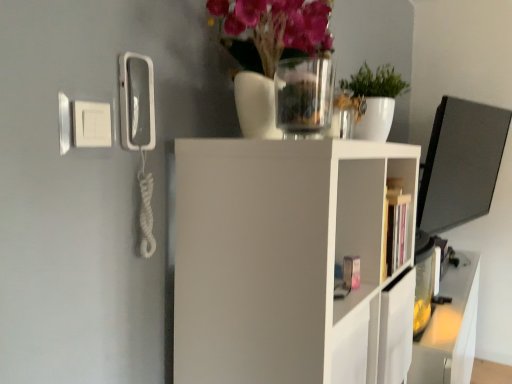
Question: Is transparent glass vase at upper center directly adjacent to translucent glass vase at upper center?

Choices:
 (A) yes
 (B) no

Answer: (A)

Question: Is transparent glass vase at upper center positioned far away from translucent glass vase at upper center?

Choices:
 (A) no
 (B) yes

Answer: (A)

Question: Does transparent glass vase at upper center have a greater height compared to translucent glass vase at upper center?

Choices:
 (A) no
 (B) yes

Answer: (A)

Question: Is transparent glass vase at upper center wider than translucent glass vase at upper center?

Choices:
 (A) no
 (B) yes

Answer: (A)

Question: Considering the relative positions of transparent glass vase at upper center and translucent glass vase at upper center in the image provided, is transparent glass vase at upper center behind translucent glass vase at upper center?

Choices:
 (A) yes
 (B) no

Answer: (A)

Question: From a real-world perspective, is green matte plant at upper center above or below matte plastic cabinet at center?

Choices:
 (A) above
 (B) below

Answer: (A)

Question: Is green matte plant at upper center inside or outside of matte plastic cabinet at center?

Choices:
 (A) outside
 (B) inside

Answer: (A)

Question: Considering the positions of green matte plant at upper center and matte plastic cabinet at center in the image, is green matte plant at upper center bigger or smaller than matte plastic cabinet at center?

Choices:
 (A) big
 (B) small

Answer: (A)

Question: Is green matte plant at upper center wider or thinner than matte plastic cabinet at center?

Choices:
 (A) wide
 (B) thin

Answer: (A)

Question: In terms of size, does translucent glass vase at upper center appear bigger or smaller than transparent glass vase at upper center?

Choices:
 (A) big
 (B) small

Answer: (A)

Question: Is translucent glass vase at upper center spatially inside transparent glass vase at upper center, or outside of it?

Choices:
 (A) outside
 (B) inside

Answer: (A)

Question: From a real-world perspective, is translucent glass vase at upper center physically located above or below transparent glass vase at upper center?

Choices:
 (A) above
 (B) below

Answer: (A)

Question: From the image's perspective, is translucent glass vase at upper center positioned above or below transparent glass vase at upper center?

Choices:
 (A) below
 (B) above

Answer: (B)

Question: Looking at the image, does matte plastic cabinet at center seem bigger or smaller compared to transparent glass vase at upper center?

Choices:
 (A) small
 (B) big

Answer: (B)

Question: Is point (360, 192) positioned closer to the camera than point (310, 89)?

Choices:
 (A) closer
 (B) farther

Answer: (B)